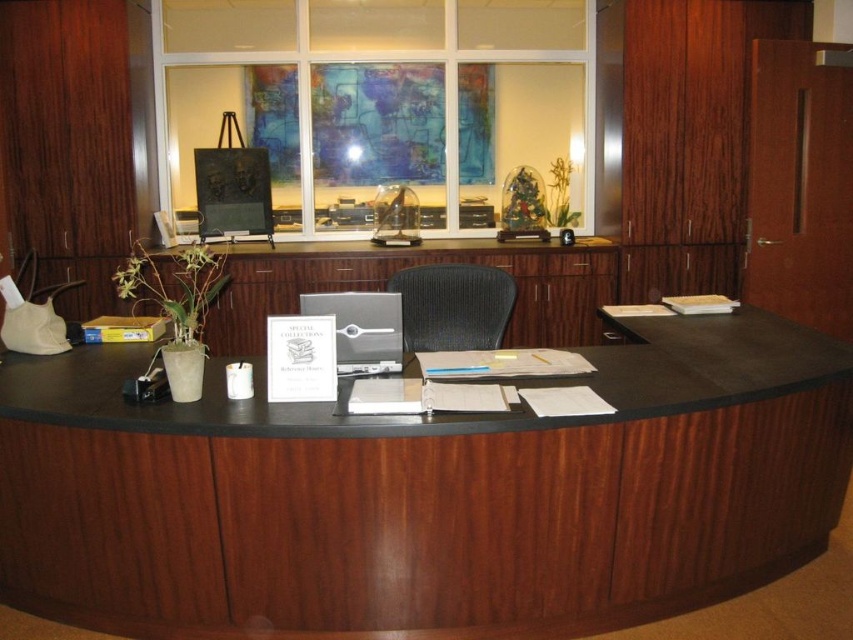
Who is lower down, wooden desk at center or satin silver laptop at center?

satin silver laptop at center is below.

How much distance is there between wooden desk at center and satin silver laptop at center?

wooden desk at center is 1.79 meters from satin silver laptop at center.

Identify the location of wooden desk at center. The image size is (853, 640). (410, 266).

At what (x,y) coordinates should I click in order to perform the action: click on wooden desk at center. Please return your answer as a coordinate pair (x, y). Looking at the image, I should click on 410,266.

Who is more forward, (479, 275) or (357, 308)?

Positioned in front is point (357, 308).

Which is more to the right, matte gray chair at center or satin silver laptop at center?

matte gray chair at center

Locate an element on the screen. matte gray chair at center is located at coordinates (453, 305).

Is dark wood/black laminate desk at center closer to the viewer compared to satin silver laptop at center?

Yes, it is in front of satin silver laptop at center.

Which is behind, point (828, 340) or point (345, 356)?

Positioned behind is point (828, 340).

I want to click on dark wood/black laminate desk at center, so click(426, 493).